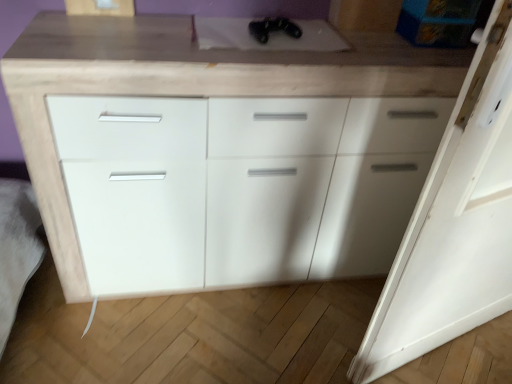
This screenshot has height=384, width=512. What are the coordinates of `white matte door at right` in the screenshot? It's located at (452, 230).

This screenshot has height=384, width=512. Describe the element at coordinates (452, 230) in the screenshot. I see `white matte door at right` at that location.

Image resolution: width=512 pixels, height=384 pixels. What are the coordinates of `black matte controller at upper center` in the screenshot? It's located at click(x=269, y=39).

Locate an element on the screen. The height and width of the screenshot is (384, 512). door located in front of the black matte controller at upper center is located at coordinates (452, 230).

Is white matte door at right shorter than black matte controller at upper center?

No, white matte door at right is not shorter than black matte controller at upper center.

Is white matte door at right bigger than black matte controller at upper center?

Yes, white matte door at right is bigger than black matte controller at upper center.

From the image's perspective, is white matte door at right over black matte controller at upper center?

No, from the image's perspective, white matte door at right is not over black matte controller at upper center.

Is white matte cabinet at center a part of white matte door at right?

That's incorrect, white matte cabinet at center is not inside white matte door at right.

Considering the sizes of white matte door at right and white matte cabinet at center in the image, is white matte door at right wider or thinner than white matte cabinet at center?

In the image, white matte door at right appears to be more narrow than white matte cabinet at center.

Measure the distance from white matte door at right to white matte cabinet at center.

25.03 inches.

Where is `the chest of drawers that appears above the white matte door at right (from the image's perspective)`? The width and height of the screenshot is (512, 384). the chest of drawers that appears above the white matte door at right (from the image's perspective) is located at coordinates (183, 86).

Is black matte controller at upper center positioned with its back to white matte cabinet at center?

Yes, black matte controller at upper center is facing away from white matte cabinet at center.

Where is `chest of drawers in front of the black matte controller at upper center`? This screenshot has width=512, height=384. chest of drawers in front of the black matte controller at upper center is located at coordinates (183, 86).

Considering the relative positions of black matte controller at upper center and white matte cabinet at center in the image provided, is black matte controller at upper center in front of white matte cabinet at center?

No, black matte controller at upper center is further to the viewer.

Is white matte cabinet at center touching white matte door at right?

No, white matte cabinet at center is not with white matte door at right.

Between white matte cabinet at center and white matte door at right, which one appears on the left side from the viewer's perspective?

From the viewer's perspective, white matte cabinet at center appears more on the left side.

In the scene shown: From the image's perspective, which is above, white matte cabinet at center or white matte door at right?

white matte cabinet at center, from the image's perspective.

Is white matte cabinet at center looking in the opposite direction of white matte door at right?

No, white matte door at right is not at the back of white matte cabinet at center.

Between white matte cabinet at center and black matte controller at upper center, which one is positioned in front?

white matte cabinet at center is in front.

Is white matte cabinet at center shorter than black matte controller at upper center?

Incorrect, the height of white matte cabinet at center does not fall short of that of black matte controller at upper center.

Is point (115, 49) positioned after point (286, 42)?

That is False.

Based on the photo, is white matte cabinet at center oriented towards black matte controller at upper center?

No, white matte cabinet at center does not turn towards black matte controller at upper center.

Which point is more distant from viewer, (339, 44) or (403, 352)?

The point (403, 352) is farther.

Where is `sink that is behind the white matte door at right`? The height and width of the screenshot is (384, 512). sink that is behind the white matte door at right is located at coordinates (269, 39).

Considering the sizes of objects black matte controller at upper center and white matte door at right in the image provided, who is shorter, black matte controller at upper center or white matte door at right?

With less height is black matte controller at upper center.

From the image's perspective, which is below, black matte controller at upper center or white matte door at right?

white matte door at right is shown below in the image.

Identify the location of door that is in front of the black matte controller at upper center. The height and width of the screenshot is (384, 512). (452, 230).

The image size is (512, 384). In order to click on the chest of drawers that is behind the white matte door at right in this screenshot , I will do pyautogui.click(x=183, y=86).

Which object lies further to the anchor point black matte controller at upper center, white matte door at right or white matte cabinet at center?

white matte door at right is positioned further to the anchor black matte controller at upper center.

From the image, which object appears to be nearer to white matte cabinet at center, white matte door at right or black matte controller at upper center?

black matte controller at upper center lies closer to white matte cabinet at center than the other object.

Estimate the real-world distances between objects in this image. Which object is closer to white matte door at right, white matte cabinet at center or black matte controller at upper center?

white matte cabinet at center is closer to white matte door at right.

Based on their spatial positions, is black matte controller at upper center or white matte door at right closer to white matte cabinet at center?

The object closer to white matte cabinet at center is black matte controller at upper center.

Estimate the real-world distances between objects in this image. Which object is closer to white matte door at right, black matte controller at upper center or white matte cabinet at center?

Among the two, white matte cabinet at center is located nearer to white matte door at right.

When comparing their distances from black matte controller at upper center, does white matte cabinet at center or white matte door at right seem closer?

white matte cabinet at center is positioned closer to the anchor black matte controller at upper center.

You are a GUI agent. You are given a task and a screenshot of the screen. Output one action in this format:
    pyautogui.click(x=<x>, y=<y>)
    Task: Click on the sink located between white matte cabinet at center and white matte door at right in the left-right direction
    This screenshot has width=512, height=384.
    Given the screenshot: What is the action you would take?
    pyautogui.click(x=269, y=39)